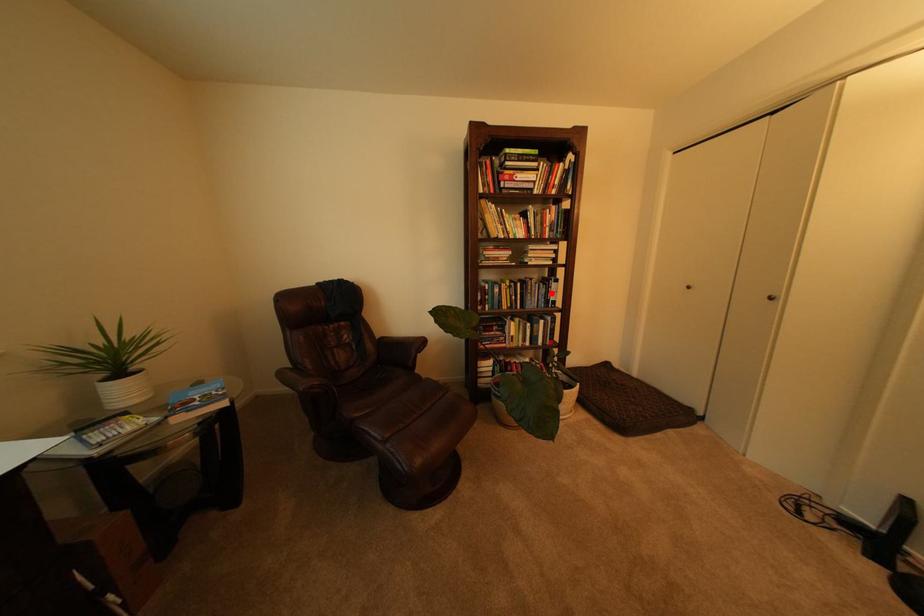
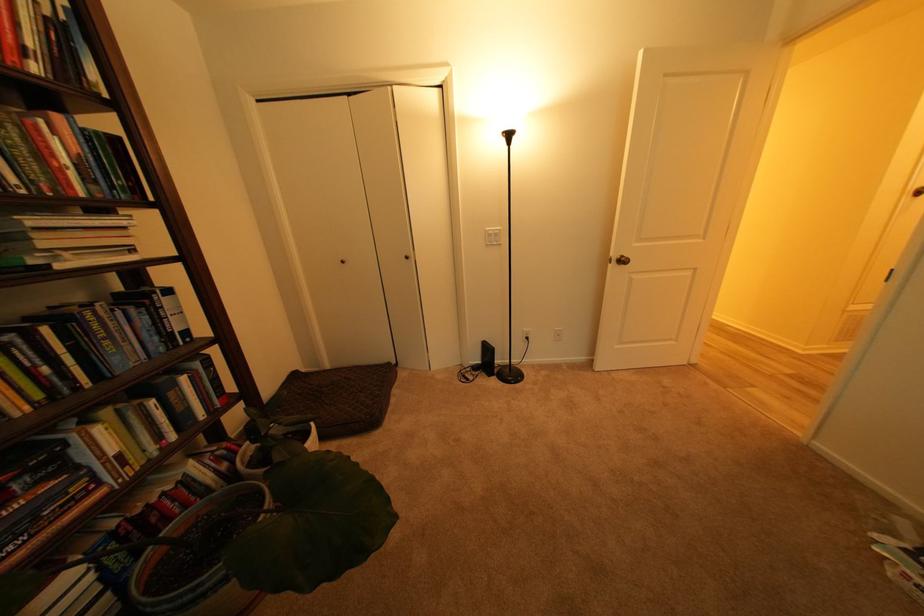
In the second image, find the point that corresponds to the highlighted location in the first image.

(150, 326)